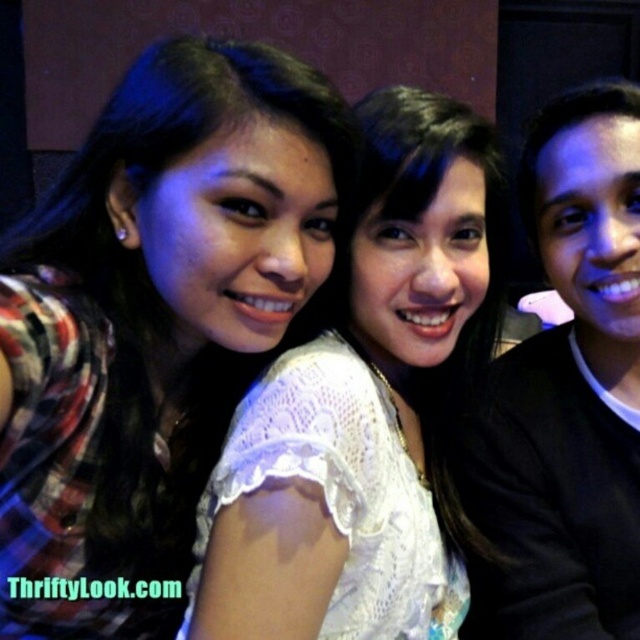
You are a photographer adjusting the lighting for a group photo. You notice the plaid fabric shirt at left and the black matte shirt at right in the frame. Which shirt should you focus on to ensure proper exposure, considering their position relative to each other?

The plaid fabric shirt at left is positioned over the black matte shirt at right, so focusing on the plaid fabric shirt at left would ensure proper exposure since it is closer to the camera.

You are taking a photo of two people in a dimly lit room with a patterned wall. The plaid fabric shirt at left and the white lace blouse at center are in the frame. Based on their positions, which clothing item is higher up in the image?

The plaid fabric shirt at left is located above the white lace blouse at center, so the plaid fabric shirt at left is higher up in the image.

You are a photographer trying to adjust the lighting for a group photo. You notice the plaid fabric shirt at left and the black matte shirt at right. Which shirt should you focus on to ensure proper exposure, considering their positions in the scene?

The plaid fabric shirt at left is in front of the black matte shirt at right, so you should focus on the plaid fabric shirt at left for proper exposure since it is closer to the camera and more prominent in the frame.